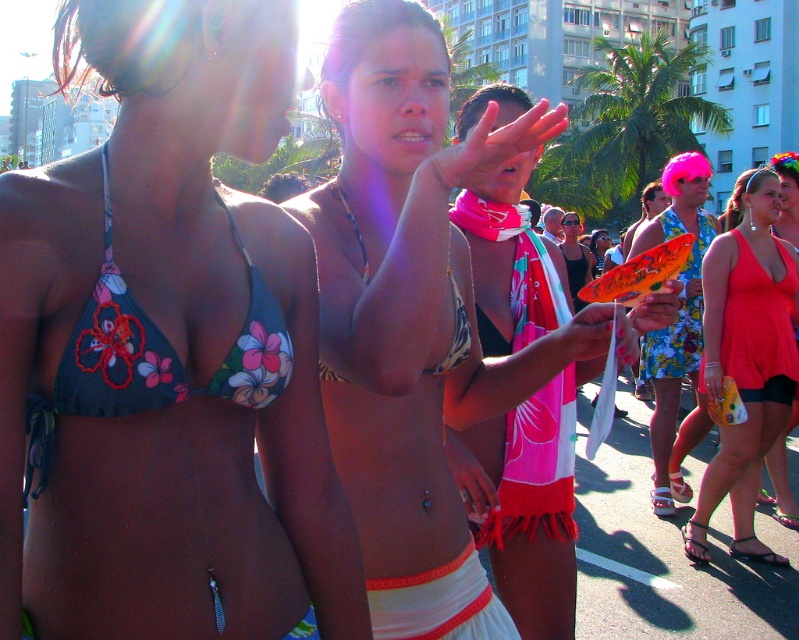
Between matte red tank top at center and floral print bikini at center, which one has less height?

matte red tank top at center

Which is behind, point (752, 252) or point (352, 212)?

The point (752, 252) is more distant.

You are a GUI agent. You are given a task and a screenshot of the screen. Output one action in this format:
    pyautogui.click(x=<x>, y=<y>)
    Task: Click on the matte red tank top at center
    This screenshot has width=799, height=640.
    Given the screenshot: What is the action you would take?
    pyautogui.click(x=746, y=356)

Who is more distant from viewer, (284, 108) or (344, 340)?

Positioned behind is point (344, 340).

Between point (54, 616) and point (324, 64), which one is positioned in front?

Point (54, 616) is more forward.

Which is behind, point (145, 460) or point (593, 308)?

Positioned behind is point (593, 308).

Locate an element on the screen. This screenshot has width=799, height=640. floral bikini top at center is located at coordinates (173, 349).

Is floral bikini top at center closer to the viewer compared to floral print fabric bikini top at left?

Yes, it is in front of floral print fabric bikini top at left.

Is floral bikini top at center to the left of floral print fabric bikini top at left from the viewer's perspective?

Yes, floral bikini top at center is to the left of floral print fabric bikini top at left.

Find the location of a particular element. floral bikini top at center is located at coordinates pyautogui.click(x=173, y=349).

Locate an element on the screen. This screenshot has width=799, height=640. floral bikini top at center is located at coordinates (173, 349).